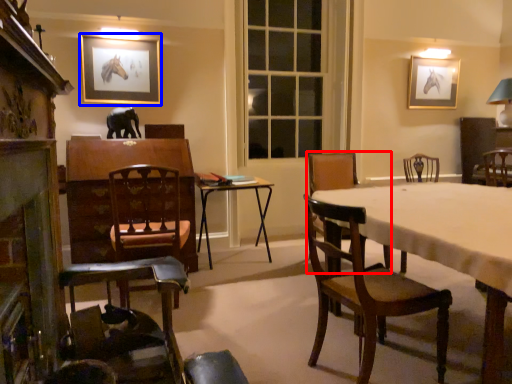
Question: Which object appears farthest to the camera in this image, chair (highlighted by a red box) or picture frame (highlighted by a blue box)?

Choices:
 (A) chair
 (B) picture frame

Answer: (B)